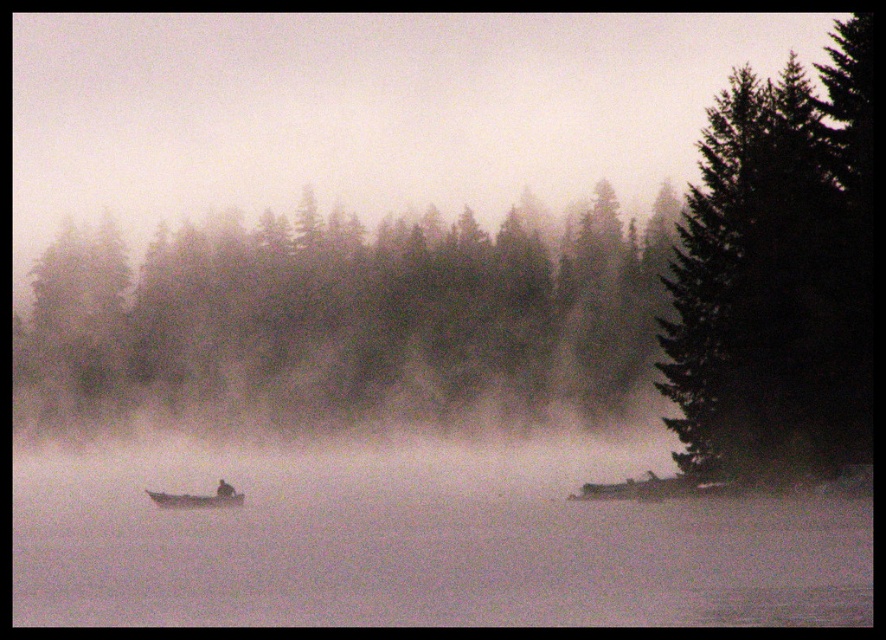
Is point (120, 360) farther from viewer compared to point (207, 500)?

Yes, point (120, 360) is farther from viewer.

Where is `green matte trees at center`? green matte trees at center is located at coordinates (346, 321).

Describe the element at coordinates (346, 321) in the screenshot. This screenshot has width=886, height=640. I see `green matte trees at center` at that location.

The width and height of the screenshot is (886, 640). I want to click on green matte trees at center, so click(x=346, y=321).

Does dark green textured tree at right have a lesser height compared to wooden boat at center?

In fact, dark green textured tree at right may be taller than wooden boat at center.

Who is lower down, dark green textured tree at right or wooden boat at center?

wooden boat at center is lower down.

Is point (719, 202) closer to viewer compared to point (185, 497)?

Yes, it is.

Locate an element on the screen. Image resolution: width=886 pixels, height=640 pixels. dark green textured tree at right is located at coordinates (776, 275).

Does green matte trees at center have a smaller size compared to dark green textured tree at right?

Incorrect, green matte trees at center is not smaller in size than dark green textured tree at right.

Who is shorter, green matte trees at center or dark green textured tree at right?

Standing shorter between the two is dark green textured tree at right.

Which is behind, point (67, 371) or point (842, 269)?

The point (67, 371) is behind.

Locate an element on the screen. green matte trees at center is located at coordinates (346, 321).